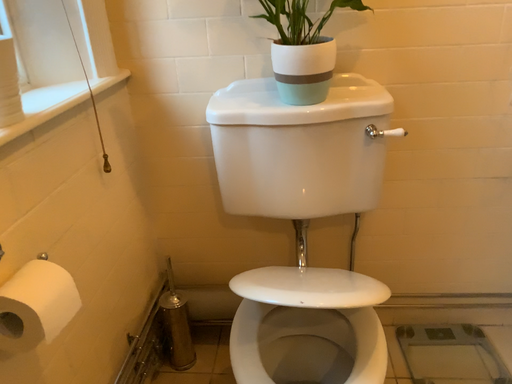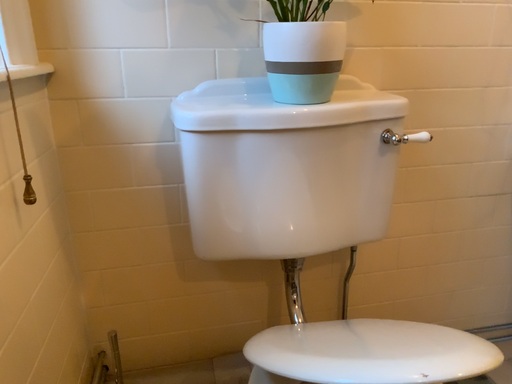
Question: How did the camera likely rotate when shooting the video?

Choices:
 (A) rotated left
 (B) rotated right

Answer: (B)